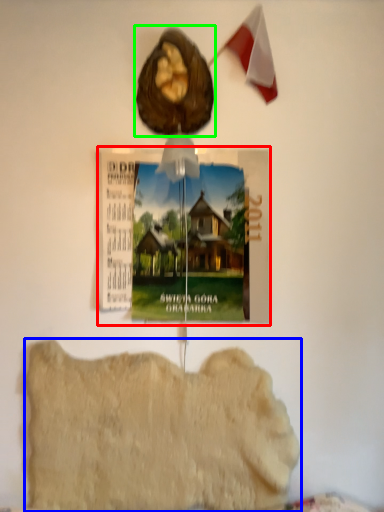
Question: Which object is the closest to the postcard (highlighted by a red box)? Choose among these: food (highlighted by a blue box) or animal (highlighted by a green box).

Choices:
 (A) food
 (B) animal

Answer: (B)